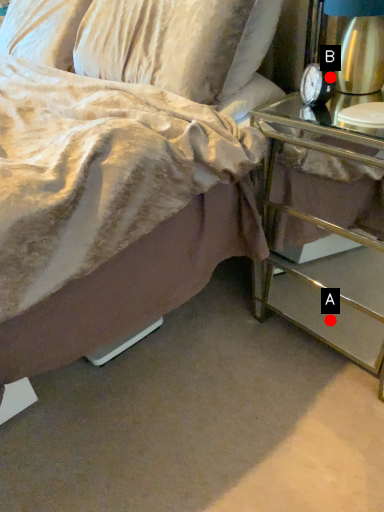
Question: Two points are circled on the image, labeled by A and B beside each circle. Which point is further to the camera?

Choices:
 (A) A is further
 (B) B is further

Answer: (A)